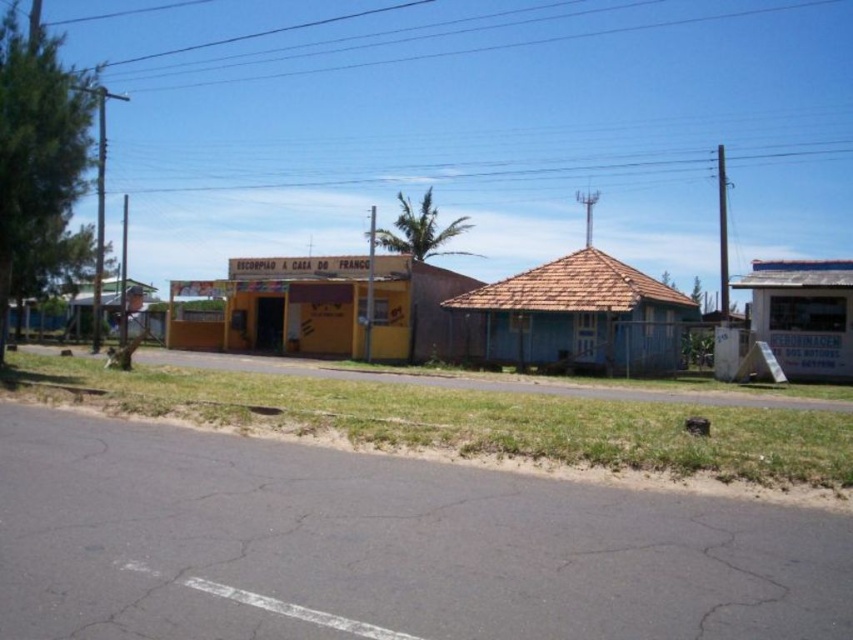
You are standing at the edge of the road and want to walk to both the yellow painted wood hut at center and the white corrugated metal hut at right. Which one should you reach first based on their distances from your current position?

The yellow painted wood hut at center is 18.88 meters away from the white corrugated metal hut at right. Since you are at the edge of the road, you need to determine which is closer. However, without knowing your exact starting point relative to both huts, it is impossible to determine which one you would reach first. The distance between the two huts alone doesn not provide enough information about their positions relative to your starting location.

Based on the photo, you are standing at the point marked by the coordinates (329, 308) in the image. What object are you currently positioned at?

You are positioned at the yellow painted wood hut at center, as the coordinates point (329, 308) represent this object.